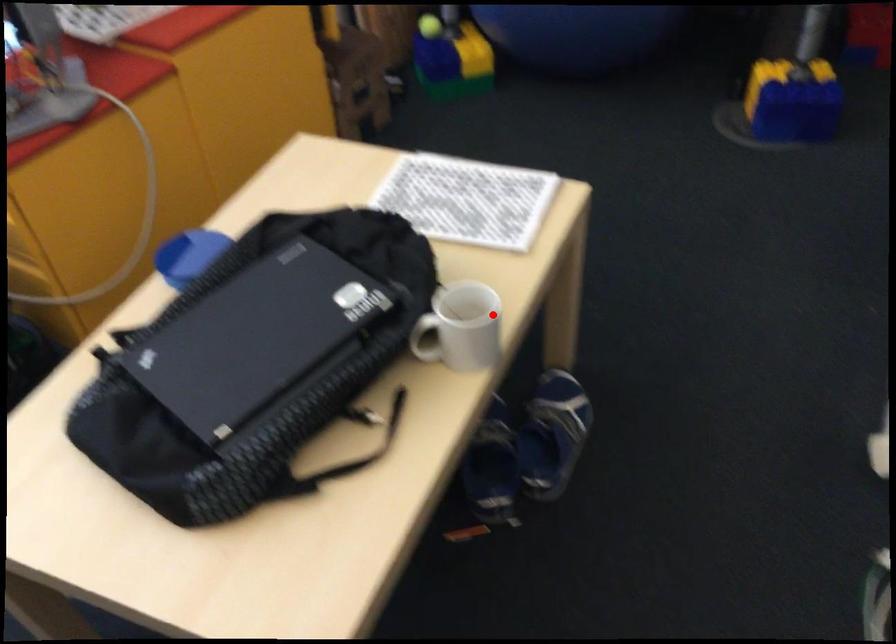
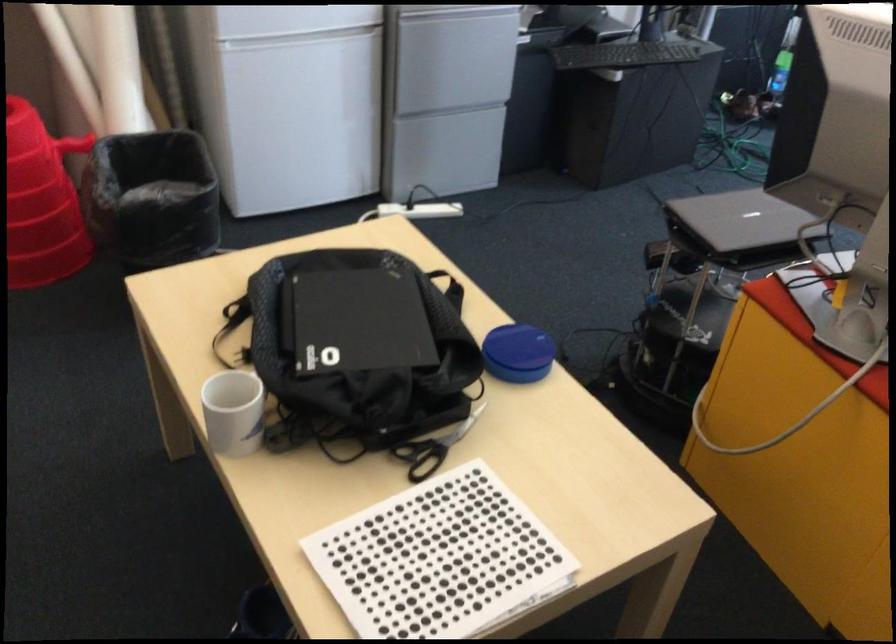
The point at the highlighted location is marked in the first image. Where is the corresponding point in the second image?

(234, 412)